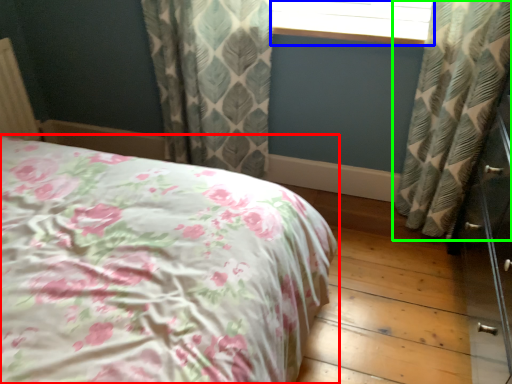
Question: Which object is the farthest from bed (highlighted by a red box)? Choose among these: window frame (highlighted by a blue box) or curtain (highlighted by a green box).

Choices:
 (A) window frame
 (B) curtain

Answer: (A)